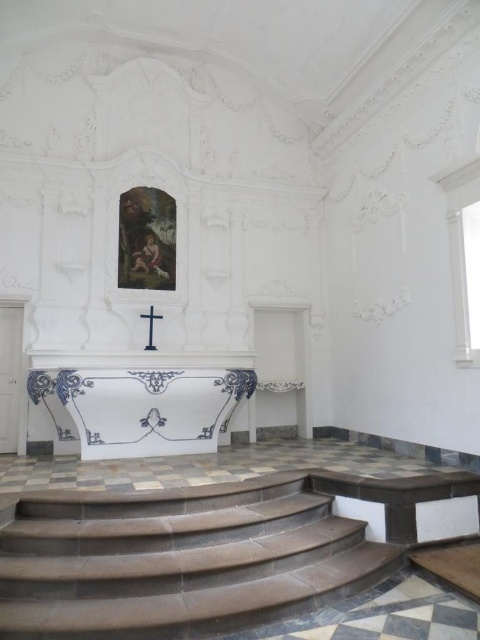
Is blue and white porcelain altar at center positioned behind black wood cross at center?

No, blue and white porcelain altar at center is closer to the viewer.

This screenshot has height=640, width=480. What do you see at coordinates (141, 406) in the screenshot?
I see `blue and white porcelain altar at center` at bounding box center [141, 406].

Find the location of a particular element. blue and white porcelain altar at center is located at coordinates (141, 406).

Is point (311, 509) farther from camera compared to point (148, 310)?

No.

Can you confirm if brown stone stairs at lower center is thinner than black wood cross at center?

In fact, brown stone stairs at lower center might be wider than black wood cross at center.

Is point (12, 582) positioned after point (145, 346)?

No.

At what (x,y) coordinates should I click in order to perform the action: click on brown stone stairs at lower center. Please return your answer as a coordinate pair (x, y). Looking at the image, I should click on [179, 560].

Between brown stone stairs at lower center and blue and white porcelain altar at center, which one appears on the left side from the viewer's perspective?

From the viewer's perspective, blue and white porcelain altar at center appears more on the left side.

Does brown stone stairs at lower center have a lesser height compared to blue and white porcelain altar at center?

Indeed, brown stone stairs at lower center has a lesser height compared to blue and white porcelain altar at center.

The height and width of the screenshot is (640, 480). What do you see at coordinates (179, 560) in the screenshot?
I see `brown stone stairs at lower center` at bounding box center [179, 560].

The width and height of the screenshot is (480, 640). I want to click on brown stone stairs at lower center, so click(x=179, y=560).